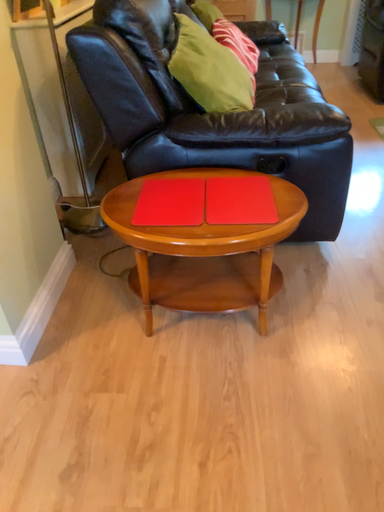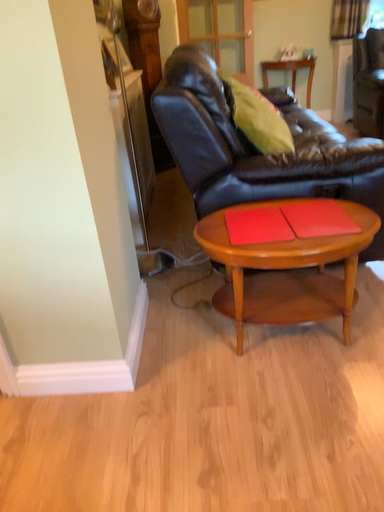
Question: Which way did the camera rotate in the video?

Choices:
 (A) rotated downward
 (B) rotated upward

Answer: (B)